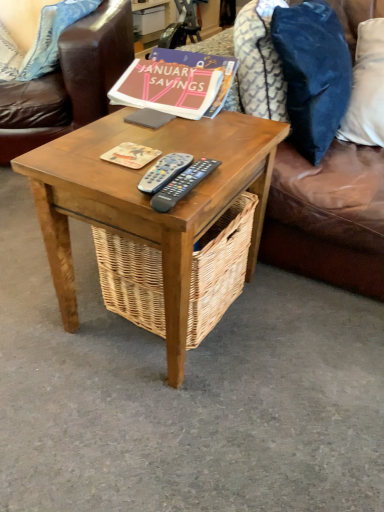
The height and width of the screenshot is (512, 384). What are the coordinates of `blue fabric pillow at upper left, positioned as the 2th pillow in left-to-right order` in the screenshot? It's located at (52, 36).

What do you see at coordinates (219, 268) in the screenshot? Image resolution: width=384 pixels, height=512 pixels. I see `woven wood picnic basket at center` at bounding box center [219, 268].

Identify the location of blue fabric pillow at upper left, the 3th pillow from the right. This screenshot has width=384, height=512. (52, 36).

Consider the image. From a real-world perspective, is velvety blue pillow at upper right, the 4th pillow when ordered from left to right, positioned over matte pink paper at upper center, the first book when ordered from top to bottom, based on gravity?

No, from a real-world perspective, velvety blue pillow at upper right, the 4th pillow when ordered from left to right, is not above matte pink paper at upper center, the first book when ordered from top to bottom.

Is velvety blue pillow at upper right, the 4th pillow when ordered from left to right, next to matte pink paper at upper center, placed as the 1th book when sorted from back to front, and touching it?

velvety blue pillow at upper right, the 4th pillow when ordered from left to right, and matte pink paper at upper center, placed as the 1th book when sorted from back to front, are not in contact.

Looking at this image, could you tell me if velvety blue pillow at upper right, the 4th pillow when ordered from left to right, is facing matte pink paper at upper center, the second book from the bottom?

No, velvety blue pillow at upper right, the 4th pillow when ordered from left to right, is not oriented towards matte pink paper at upper center, the second book from the bottom.

Considering the relative sizes of velvety blue pillow at upper right, which is counted as the 1th pillow, starting from the right, and matte pink paper at upper center, placed as the 1th book when sorted from back to front, in the image provided, is velvety blue pillow at upper right, which is counted as the 1th pillow, starting from the right, shorter than matte pink paper at upper center, placed as the 1th book when sorted from back to front,?

No, velvety blue pillow at upper right, which is counted as the 1th pillow, starting from the right, is not shorter than matte pink paper at upper center, placed as the 1th book when sorted from back to front.

Looking at this image, in terms of width, does velvety blue pillow at upper right, positioned as the second pillow in right-to-left order, look wider or thinner when compared to velvety blue pillow at upper right, the 4th pillow when ordered from left to right?

In the image, velvety blue pillow at upper right, positioned as the second pillow in right-to-left order, appears to be more narrow than velvety blue pillow at upper right, the 4th pillow when ordered from left to right.

Based on the photo, based on their positions, is velvety blue pillow at upper right, positioned as the second pillow in right-to-left order, located to the left or right of velvety blue pillow at upper right, the 4th pillow when ordered from left to right?

A: In the image, velvety blue pillow at upper right, positioned as the second pillow in right-to-left order, appears on the left side of velvety blue pillow at upper right, the 4th pillow when ordered from left to right.

Locate an element on the screen. Image resolution: width=384 pixels, height=512 pixels. the 1st pillow behind the velvety blue pillow at upper right, positioned as the second pillow in right-to-left order is located at coordinates (366, 88).

Can you confirm if velvety blue pillow at upper right, positioned as the second pillow in right-to-left order, is smaller than velvety blue pillow at upper right, the 4th pillow when ordered from left to right?

No, velvety blue pillow at upper right, positioned as the second pillow in right-to-left order, is not smaller than velvety blue pillow at upper right, the 4th pillow when ordered from left to right.

Which of these two, blue fabric pillow at upper left, the first pillow in the left-to-right sequence, or velvety blue pillow at upper right, positioned as the second pillow in right-to-left order, stands taller?

Standing taller between the two is velvety blue pillow at upper right, positioned as the second pillow in right-to-left order.

Does blue fabric pillow at upper left, the first pillow in the left-to-right sequence, turn towards velvety blue pillow at upper right, positioned as the second pillow in right-to-left order?

Yes.

Which is more to the left, blue fabric pillow at upper left, the fourth pillow in the right-to-left sequence, or velvety blue pillow at upper right, positioned as the second pillow in right-to-left order?

Positioned to the left is blue fabric pillow at upper left, the fourth pillow in the right-to-left sequence.

Does blue fabric pillow at upper left, the first pillow in the left-to-right sequence, have a smaller size compared to velvety blue pillow at upper right, placed as the 3th pillow when sorted from left to right?

Yes.

In the scene shown: From a real-world perspective, is matte cardboard coaster at center, the 2th book from the back, physically located above or below blue fabric pillow at upper left, the first pillow in the left-to-right sequence?

In terms of real-world spatial position, matte cardboard coaster at center, the 2th book from the back, is above blue fabric pillow at upper left, the first pillow in the left-to-right sequence.

Which pillow is the 4th one when counting from the back of the matte cardboard coaster at center, which is the 1th book from front to back? Please provide its 2D coordinates.

[(18, 32)]

Is matte cardboard coaster at center, which is the first book in bottom-to-top order, taller than blue fabric pillow at upper left, the fourth pillow in the right-to-left sequence?

No.

From the image's perspective, who appears lower, matte cardboard coaster at center, which is the first book in bottom-to-top order, or blue fabric pillow at upper left, the first pillow in the left-to-right sequence?

From the image's view, matte cardboard coaster at center, which is the first book in bottom-to-top order, is below.

Is matte pink paper at upper center, the first book when ordered from top to bottom, turned away from matte cardboard coaster at center, the 2th book from the back?

matte pink paper at upper center, the first book when ordered from top to bottom, is not turned away from matte cardboard coaster at center, the 2th book from the back.

From a real-world perspective, is matte pink paper at upper center, placed as the 1th book when sorted from back to front, under matte cardboard coaster at center, which is the 1th book from front to back?

No.

I want to click on book above the matte cardboard coaster at center, the 2th book from the back (from a real-world perspective), so click(x=167, y=88).

From the image's perspective, is matte pink paper at upper center, positioned as the 2th book in front-to-back order, above matte cardboard coaster at center, the 2th book from the back?

Yes, from the image's perspective, matte pink paper at upper center, positioned as the 2th book in front-to-back order, is above matte cardboard coaster at center, the 2th book from the back.

Could you tell me if wooden side table at center is facing black plastic remote at center, which is the 1th remote control from left to right?

No, wooden side table at center is not aimed at black plastic remote at center, which is the 1th remote control from left to right.

Consider the image. Considering the relative positions of wooden side table at center and black plastic remote at center, which is the 2th remote control from right to left, in the image provided, is wooden side table at center to the left or to the right of black plastic remote at center, which is the 2th remote control from right to left,?

wooden side table at center is positioned on black plastic remote at center, which is the 2th remote control from right to left,'s left side.

Between wooden side table at center and black plastic remote at center, which is the 2th remote control from right to left, which one has smaller width?

Thinner between the two is black plastic remote at center, which is the 2th remote control from right to left.

From the image's perspective, is wooden side table at center located above or below black plastic remote at center, which is the 2th remote control from right to left?

Clearly, from the image's perspective, wooden side table at center is below black plastic remote at center, which is the 2th remote control from right to left.

From a real-world perspective, is wooden side table at center positioned above or below black plastic remote control at center, the second remote control viewed from the left?

From a real-world perspective, wooden side table at center is physically below black plastic remote control at center, the second remote control viewed from the left.

Is wooden side table at center oriented towards black plastic remote control at center, the first remote control viewed from the right?

No.

Considering the sizes of objects wooden side table at center and black plastic remote control at center, the second remote control viewed from the left, in the image provided, who is smaller, wooden side table at center or black plastic remote control at center, the second remote control viewed from the left,?

black plastic remote control at center, the second remote control viewed from the left.

Locate an element on the screen. pillow that is the 1st object located behind the matte pink paper at upper center, placed as the 1th book when sorted from back to front is located at coordinates (366, 88).

You are a GUI agent. You are given a task and a screenshot of the screen. Output one action in this format:
    pyautogui.click(x=<x>, y=<y>)
    Task: Click on the pillow above the velvety blue pillow at upper right, which is counted as the 1th pillow, starting from the right (from a real-world perspective)
    Image resolution: width=384 pixels, height=512 pixels.
    Given the screenshot: What is the action you would take?
    pyautogui.click(x=313, y=73)

Which object lies further to the anchor point black plastic remote at center, which is the 1th remote control from left to right, matte cardboard coaster at center, the 2th book from the back, or black plastic remote control at center, the first remote control viewed from the right?

Based on the image, matte cardboard coaster at center, the 2th book from the back, appears to be further to black plastic remote at center, which is the 1th remote control from left to right.

Looking at the image, which one is located further to blue fabric pillow at upper left, the fourth pillow in the right-to-left sequence, woven wood picnic basket at center or black plastic remote at center, which is the 2th remote control from right to left?

black plastic remote at center, which is the 2th remote control from right to left, is positioned further to the anchor blue fabric pillow at upper left, the fourth pillow in the right-to-left sequence.

Based on their spatial positions, is blue fabric pillow at upper left, the 3th pillow from the right, or blue fabric pillow at upper left, the fourth pillow in the right-to-left sequence, closer to black plastic remote at center, which is the 2th remote control from right to left?

Among the two, blue fabric pillow at upper left, the 3th pillow from the right, is located nearer to black plastic remote at center, which is the 2th remote control from right to left.

From the picture: When comparing their distances from woven wood picnic basket at center, does velvety blue pillow at upper right, placed as the 3th pillow when sorted from left to right, or blue fabric pillow at upper left, positioned as the 2th pillow in left-to-right order, seem closer?

Among the two, velvety blue pillow at upper right, placed as the 3th pillow when sorted from left to right, is located nearer to woven wood picnic basket at center.

In the scene shown: Based on their spatial positions, is woven wood picnic basket at center or black plastic remote at center, which is the 1th remote control from left to right, closer to velvety blue pillow at upper right, which is counted as the 1th pillow, starting from the right?

woven wood picnic basket at center.

Which object lies nearer to the anchor point black plastic remote control at center, the first remote control viewed from the right, woven wood picnic basket at center or wooden side table at center?

The object closer to black plastic remote control at center, the first remote control viewed from the right, is wooden side table at center.

Looking at the image, which one is located further to matte cardboard coaster at center, acting as the second book starting from the top, velvety blue pillow at upper right, the 4th pillow when ordered from left to right, or wooden side table at center?

velvety blue pillow at upper right, the 4th pillow when ordered from left to right, lies further to matte cardboard coaster at center, acting as the second book starting from the top, than the other object.

From the image, which object appears to be farther from woven wood picnic basket at center, velvety blue pillow at upper right, positioned as the second pillow in right-to-left order, or matte pink paper at upper center, positioned as the 2th book in front-to-back order?

velvety blue pillow at upper right, positioned as the second pillow in right-to-left order.

This screenshot has height=512, width=384. Identify the location of remote control located between woven wood picnic basket at center and velvety blue pillow at upper right, which is counted as the 1th pillow, starting from the right, in the left-right direction. (182, 184).

Find the location of a particular element. Image resolution: width=384 pixels, height=512 pixels. desk between matte cardboard coaster at center, acting as the second book starting from the top, and brown leather couch at upper right is located at coordinates (149, 201).

Where is `book between matte pink paper at upper center, placed as the 1th book when sorted from back to front, and wooden side table at center vertically`? This screenshot has height=512, width=384. book between matte pink paper at upper center, placed as the 1th book when sorted from back to front, and wooden side table at center vertically is located at coordinates (131, 155).

Locate an element on the screen. Image resolution: width=384 pixels, height=512 pixels. pillow between wooden side table at center and velvety blue pillow at upper right, the 4th pillow when ordered from left to right, in the horizontal direction is located at coordinates (313, 73).